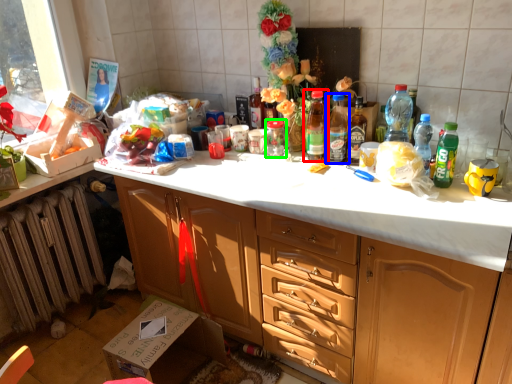
Question: Considering the real-world distances, which object is farthest from bottle (highlighted by a red box)? bottle (highlighted by a blue box) or glass jar (highlighted by a green box)?

Choices:
 (A) bottle
 (B) glass jar

Answer: (B)